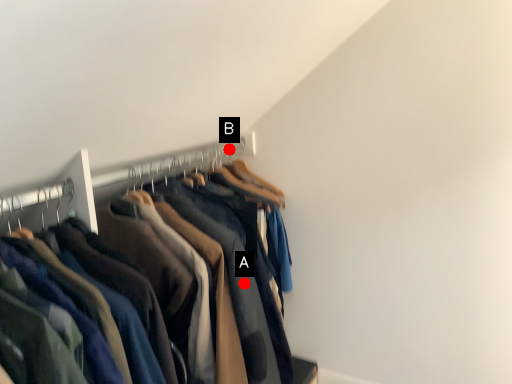
Question: Two points are circled on the image, labeled by A and B beside each circle. Which point is closer to the camera?

Choices:
 (A) A is closer
 (B) B is closer

Answer: (A)